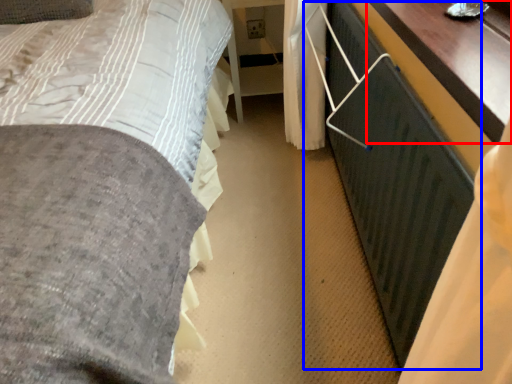
Question: Which of the following is the farthest to the observer, table (highlighted by a red box) or balustrade (highlighted by a blue box)?

Choices:
 (A) table
 (B) balustrade

Answer: (A)